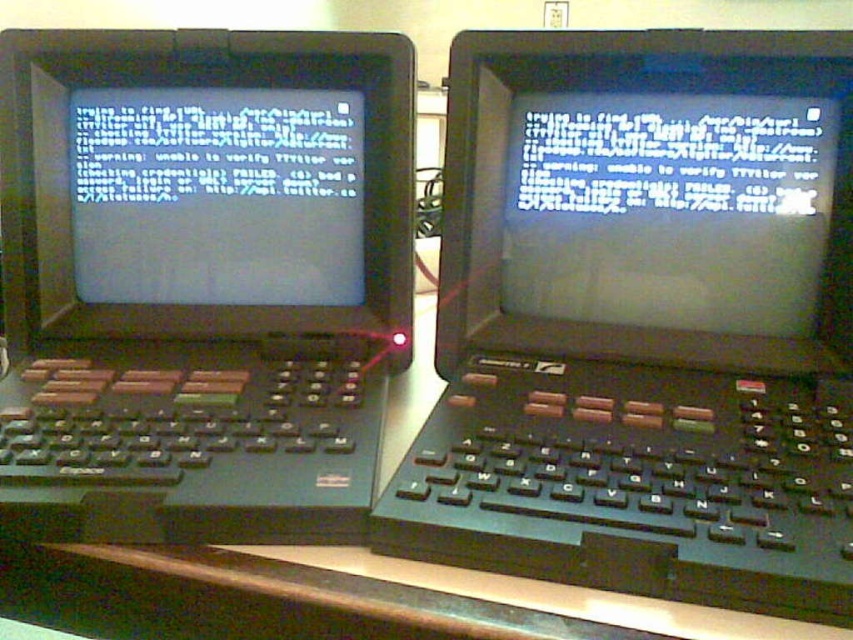
Question: Considering the relative positions of white matte monitor at center and wooden table at center in the image provided, where is white matte monitor at center located with respect to wooden table at center?

Choices:
 (A) above
 (B) below

Answer: (A)

Question: In this image, where is black plastic laptop at center located relative to wooden table at center?

Choices:
 (A) above
 (B) below

Answer: (A)

Question: Is black plastic computer at left below wooden table at center?

Choices:
 (A) yes
 (B) no

Answer: (B)

Question: Which object appears farthest from the camera in this image?

Choices:
 (A) white matte monitor at center
 (B) wooden table at center

Answer: (A)

Question: Among these objects, which one is farthest from the camera?

Choices:
 (A) black plastic computer at left
 (B) black plastic laptop at center
 (C) wooden table at center
 (D) white matte monitor at center

Answer: (D)

Question: Which is farther from the black plastic laptop at center?

Choices:
 (A) white matte monitor at center
 (B) wooden table at center

Answer: (A)